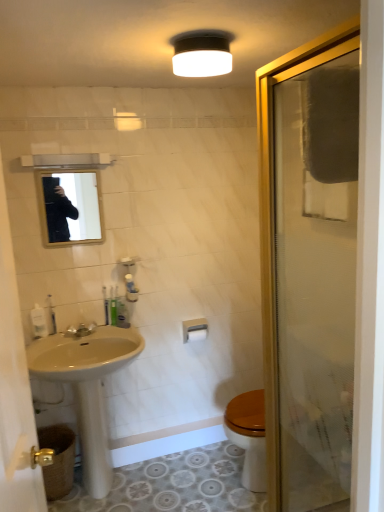
Identify the location of blank area to the left of matte silver faucet at lower left. (51, 339).